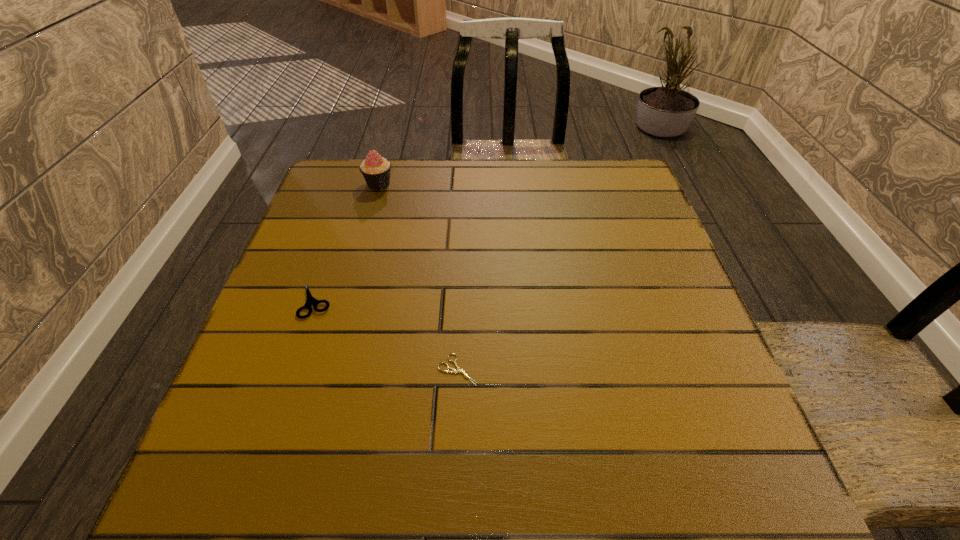
The height and width of the screenshot is (540, 960). I want to click on free area in between the cupcake and the taller shears, so click(348, 242).

Identify the location of blank region between the farthest object and the shorter shears. Image resolution: width=960 pixels, height=540 pixels. (419, 277).

Where is `blank region between the second nearest object and the cupcake`? The width and height of the screenshot is (960, 540). blank region between the second nearest object and the cupcake is located at coordinates (348, 242).

Image resolution: width=960 pixels, height=540 pixels. In order to click on free space between the shortest object and the taller shears in this screenshot , I will do `click(387, 335)`.

At what (x,y) coordinates should I click in order to perform the action: click on free space between the shortest object and the tallest object. Please return your answer as a coordinate pair (x, y). Image resolution: width=960 pixels, height=540 pixels. Looking at the image, I should click on (419, 277).

I want to click on empty space between the cupcake and the second tallest object, so click(348, 242).

The width and height of the screenshot is (960, 540). Find the location of `empty space that is in between the nearer shears and the second tallest object`. empty space that is in between the nearer shears and the second tallest object is located at coordinates (387, 335).

The image size is (960, 540). I want to click on object that is the closest to the farthest object, so click(310, 300).

Locate which object is the closest to the farthest object. Please provide its 2D coordinates. Your answer should be formatted as a tuple, i.e. [(x, y)], where the tuple contains the x and y coordinates of a point satisfying the conditions above.

[(310, 300)]

Where is `free region that satisfies the following two spatial constraints: 1. on the front side of the right shears; 2. on the left side of the farther shears`? free region that satisfies the following two spatial constraints: 1. on the front side of the right shears; 2. on the left side of the farther shears is located at coordinates (293, 370).